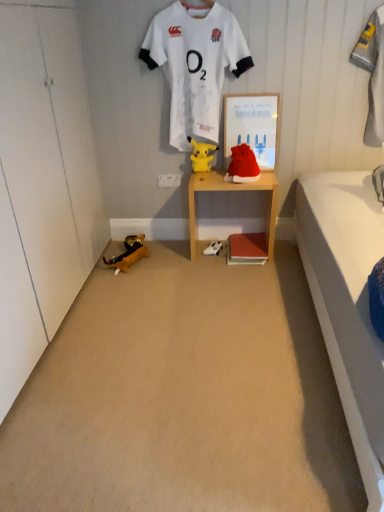
This screenshot has width=384, height=512. What do you see at coordinates (129, 253) in the screenshot? I see `yellow plush toy at lower left, which is the 3th toy from top to bottom` at bounding box center [129, 253].

Find the location of a particular element. The width and height of the screenshot is (384, 512). white jersey at upper center is located at coordinates (195, 63).

How much space does red velvet santa hat at center, positioned as the 2th toy in bottom-to-top order, occupy horizontally?

It is 5.95 inches.

Image resolution: width=384 pixels, height=512 pixels. What are the coordinates of `white paper at center` in the screenshot? It's located at (252, 126).

Is white paper at center turned away from yellow plush toy at lower left, the first toy from the bottom?

white paper at center does not have its back to yellow plush toy at lower left, the first toy from the bottom.

Find the location of `picture frame above the yellow plush toy at lower left, the first toy from the bottom (from the image's perspective)`. picture frame above the yellow plush toy at lower left, the first toy from the bottom (from the image's perspective) is located at coordinates (252, 126).

Considering the relative positions of white paper at center and yellow plush toy at lower left, the first toy from the bottom, in the image provided, is white paper at center to the left of yellow plush toy at lower left, the first toy from the bottom, from the viewer's perspective?

No.

Is point (213, 247) behind point (235, 175)?

Yes.

Which object is positioned more to the left, white fabric shoe at lower center or red velvet santa hat at center, placed as the 1th toy when sorted from right to left?

Positioned to the left is white fabric shoe at lower center.

Is white fabric shoe at lower center bigger than red velvet santa hat at center, positioned as the 2th toy in bottom-to-top order?

Incorrect, white fabric shoe at lower center is not larger than red velvet santa hat at center, positioned as the 2th toy in bottom-to-top order.

How distant is white fabric shoe at lower center from red velvet santa hat at center, the 3th toy from the left?

white fabric shoe at lower center is 20.81 inches away from red velvet santa hat at center, the 3th toy from the left.

Does red velvet santa hat at center, the 2th toy when ordered from top to bottom, touch white jersey at upper center?

They are not placed beside each other.

From the image's perspective, is red velvet santa hat at center, placed as the 1th toy when sorted from right to left, positioned above or below white jersey at upper center?

red velvet santa hat at center, placed as the 1th toy when sorted from right to left, is situated lower than white jersey at upper center in the image.

In terms of width, does red velvet santa hat at center, the 2th toy when ordered from top to bottom, look wider or thinner when compared to white jersey at upper center?

In the image, red velvet santa hat at center, the 2th toy when ordered from top to bottom, appears to be wider than white jersey at upper center.

Considering the positions of point (240, 145) and point (177, 97), is point (240, 145) closer or farther from the camera than point (177, 97)?

Point (240, 145) is positioned farther from the camera compared to point (177, 97).

Which is nearer, (267, 145) or (367, 119)?

Point (367, 119)

From the image's perspective, which one is positioned lower, white paper at center or gray fabric towel at upper right?

white paper at center is shown below in the image.

Based on the photo, who is taller, white paper at center or gray fabric towel at upper right?

gray fabric towel at upper right.

From a real-world perspective, between white paper at center and gray fabric towel at upper right, who is vertically lower?

white paper at center is physically lower.

Would you say yellow plush toy at center, which appears as the 1th toy when viewed from the top, is inside or outside white paper at center?

The correct answer is: outside.

From a real-world perspective, is yellow plush toy at center, the 2th toy viewed from the right, on white paper at center?

Actually, yellow plush toy at center, the 2th toy viewed from the right, is physically below white paper at center in the real world.

What are the coordinates of `picture frame above the yellow plush toy at center, which is the second toy in left-to-right order (from the image's perspective)` in the screenshot? It's located at (252, 126).

How different are the orientations of yellow plush toy at center, which is the second toy in left-to-right order, and white paper at center in degrees?

0.301 degrees separate the facing orientations of yellow plush toy at center, which is the second toy in left-to-right order, and white paper at center.

Is white jersey at upper center a part of gray fabric towel at upper right?

No, white jersey at upper center is not inside gray fabric towel at upper right.

What's the angular difference between gray fabric towel at upper right and white jersey at upper center's facing directions?

0.00207 degrees separate the facing orientations of gray fabric towel at upper right and white jersey at upper center.

Considering the positions of objects gray fabric towel at upper right and white jersey at upper center in the image provided, who is more to the right, gray fabric towel at upper right or white jersey at upper center?

gray fabric towel at upper right is more to the right.

Based on the photo, can you confirm if gray fabric towel at upper right is taller than white jersey at upper center?

No, gray fabric towel at upper right is not taller than white jersey at upper center.

From a real-world perspective, who is located higher, white fabric shoe at lower center or wooden shelf at center?

In real-world perspective, wooden shelf at center is above.

Is white fabric shoe at lower center aimed at wooden shelf at center?

Yes, white fabric shoe at lower center is facing wooden shelf at center.

Based on their positions, is white fabric shoe at lower center located to the left or right of wooden shelf at center?

white fabric shoe at lower center is positioned on wooden shelf at center's left side.

From the image's perspective, is white fabric shoe at lower center over wooden shelf at center?

No, from the image's perspective, white fabric shoe at lower center is not over wooden shelf at center.

Identify the location of picture frame above the yellow plush toy at lower left, the first toy from the bottom (from the image's perspective). Image resolution: width=384 pixels, height=512 pixels. (252, 126).

What are the coordinates of `toy on the right of the white fabric shoe at lower center` in the screenshot? It's located at (242, 165).

When comparing their distances from gray fabric towel at upper right, does red velvet santa hat at center, the 3th toy from the left, or yellow plush toy at lower left, which is the 3th toy from top to bottom, seem closer?

Among the two, red velvet santa hat at center, the 3th toy from the left, is located nearer to gray fabric towel at upper right.

Based on their spatial positions, is wooden shelf at center or white fabric shoe at lower center closer to gray fabric towel at upper right?

Based on the image, wooden shelf at center appears to be nearer to gray fabric towel at upper right.

Considering their positions, is white paper at center positioned closer to red velvet santa hat at center, positioned as the 2th toy in bottom-to-top order, than white jersey at upper center?

white paper at center lies closer to red velvet santa hat at center, positioned as the 2th toy in bottom-to-top order, than the other object.

Based on the photo, when comparing their distances from red velvet santa hat at center, the 2th toy when ordered from top to bottom, does gray fabric towel at upper right or wooden shelf at center seem closer?

wooden shelf at center is positioned closer to the anchor red velvet santa hat at center, the 2th toy when ordered from top to bottom.

Based on their spatial positions, is yellow plush toy at lower left, the first toy from the bottom, or yellow plush toy at center, the 3th toy from the bottom, further from wooden shelf at center?

Among the two, yellow plush toy at lower left, the first toy from the bottom, is located further to wooden shelf at center.

Which object lies further to the anchor point white fabric shoe at lower center, yellow plush toy at center, the 3th toy from the bottom, or red velvet santa hat at center, positioned as the 2th toy in bottom-to-top order?

The object further to white fabric shoe at lower center is yellow plush toy at center, the 3th toy from the bottom.

When comparing their distances from white fabric shoe at lower center, does wooden shelf at center or white paper at center seem further?

Among the two, white paper at center is located further to white fabric shoe at lower center.

Estimate the real-world distances between objects in this image. Which object is further from yellow plush toy at lower left, the 3th toy positioned from the right, gray fabric towel at upper right or red velvet santa hat at center, placed as the 1th toy when sorted from right to left?

gray fabric towel at upper right lies further to yellow plush toy at lower left, the 3th toy positioned from the right, than the other object.

Find the location of `shelf between yellow plush toy at center, the 2th toy viewed from the right, and white fabric shoe at lower center, in the vertical direction`. shelf between yellow plush toy at center, the 2th toy viewed from the right, and white fabric shoe at lower center, in the vertical direction is located at coordinates (233, 191).

The image size is (384, 512). What are the coordinates of `footwear between white jersey at upper center and yellow plush toy at lower left, the first toy from the bottom, in the up-down direction` in the screenshot? It's located at (213, 248).

This screenshot has width=384, height=512. I want to click on footwear situated between yellow plush toy at lower left, the first toy positioned from the left, and gray fabric towel at upper right from left to right, so click(213, 248).

Locate an element on the screen. footwear between yellow plush toy at lower left, the first toy from the bottom, and white paper at center is located at coordinates (x=213, y=248).